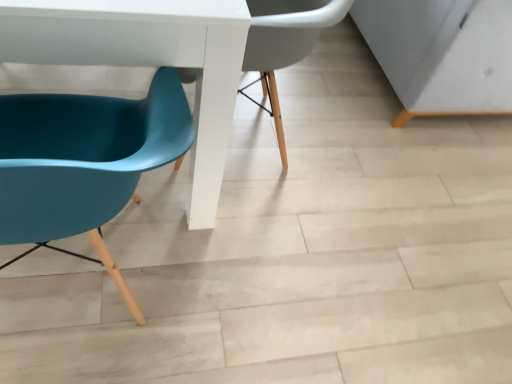
Question: Considering the relative positions of white glossy table at lower left and teal plastic chair at left, the 1th chair viewed from the top, in the image provided, is white glossy table at lower left to the left of teal plastic chair at left, the 1th chair viewed from the top, from the viewer's perspective?

Choices:
 (A) no
 (B) yes

Answer: (B)

Question: From the image's perspective, is white glossy table at lower left below teal plastic chair at left, the 1th chair viewed from the top?

Choices:
 (A) no
 (B) yes

Answer: (A)

Question: Considering the relative sizes of white glossy table at lower left and teal plastic chair at left, the second chair when ordered from bottom to top, in the image provided, is white glossy table at lower left smaller than teal plastic chair at left, the second chair when ordered from bottom to top,?

Choices:
 (A) yes
 (B) no

Answer: (B)

Question: Considering the relative sizes of white glossy table at lower left and teal plastic chair at left, the 1th chair viewed from the top, in the image provided, is white glossy table at lower left wider than teal plastic chair at left, the 1th chair viewed from the top,?

Choices:
 (A) no
 (B) yes

Answer: (B)

Question: Considering the relative sizes of white glossy table at lower left and teal plastic chair at left, the 1th chair viewed from the top, in the image provided, is white glossy table at lower left bigger than teal plastic chair at left, the 1th chair viewed from the top,?

Choices:
 (A) yes
 (B) no

Answer: (A)

Question: Looking at the image, does teal plastic chair at left, the 1th chair viewed from the top, seem bigger or smaller compared to white glossy table at lower left?

Choices:
 (A) small
 (B) big

Answer: (A)

Question: Considering the positions of teal plastic chair at left, the second chair when ordered from bottom to top, and white glossy table at lower left in the image, is teal plastic chair at left, the second chair when ordered from bottom to top, wider or thinner than white glossy table at lower left?

Choices:
 (A) thin
 (B) wide

Answer: (A)

Question: Is teal plastic chair at left, the 1th chair viewed from the top, taller or shorter than white glossy table at lower left?

Choices:
 (A) short
 (B) tall

Answer: (A)

Question: Which is correct: teal plastic chair at left, the second chair when ordered from bottom to top, is inside white glossy table at lower left, or outside of it?

Choices:
 (A) outside
 (B) inside

Answer: (B)

Question: Based on their sizes in the image, would you say teal plastic chair at left, arranged as the 1th chair when ordered from the bottom, is bigger or smaller than teal plastic chair at left, the 1th chair viewed from the top?

Choices:
 (A) small
 (B) big

Answer: (A)

Question: Is teal plastic chair at left, arranged as the 1th chair when ordered from the bottom, wider or thinner than teal plastic chair at left, the second chair when ordered from bottom to top?

Choices:
 (A) thin
 (B) wide

Answer: (A)

Question: Considering the positions of point (55, 218) and point (285, 162), is point (55, 218) closer or farther from the camera than point (285, 162)?

Choices:
 (A) closer
 (B) farther

Answer: (A)

Question: Visually, is teal plastic chair at left, the second chair from the top, positioned to the left or to the right of teal plastic chair at left, the second chair when ordered from bottom to top?

Choices:
 (A) left
 (B) right

Answer: (A)

Question: From the image's perspective, relative to teal plastic chair at left, the second chair when ordered from bottom to top, is white glossy table at lower left above or below?

Choices:
 (A) above
 (B) below

Answer: (A)

Question: Looking at their shapes, would you say white glossy table at lower left is wider or thinner than teal plastic chair at left, the 1th chair viewed from the top?

Choices:
 (A) wide
 (B) thin

Answer: (A)